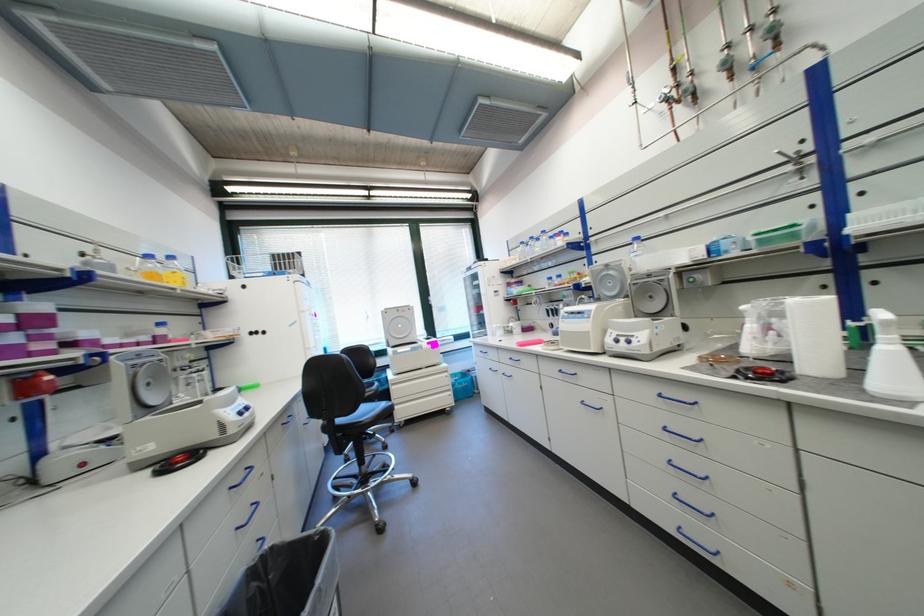
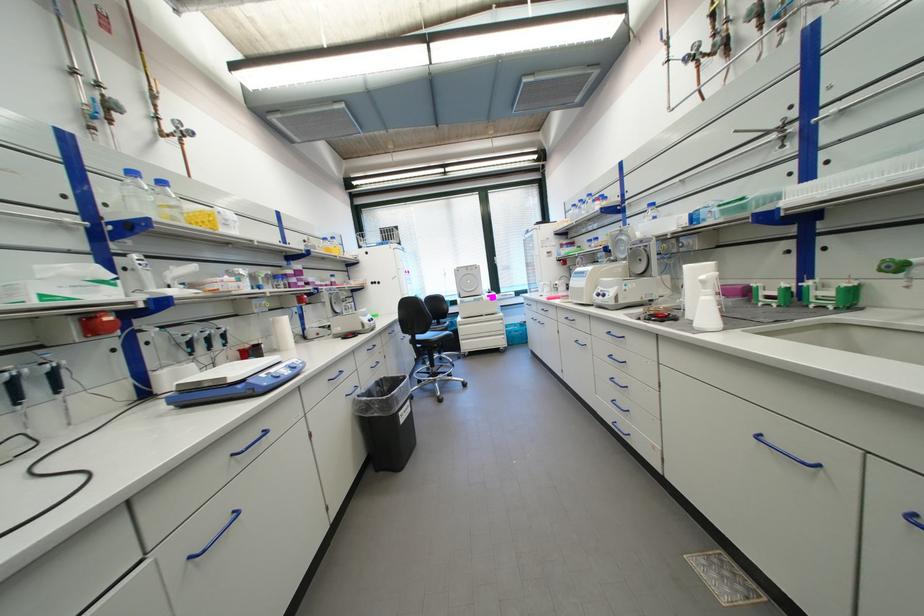
In the second image, find the point that corresponds to (x=756, y=379) in the first image.

(655, 321)